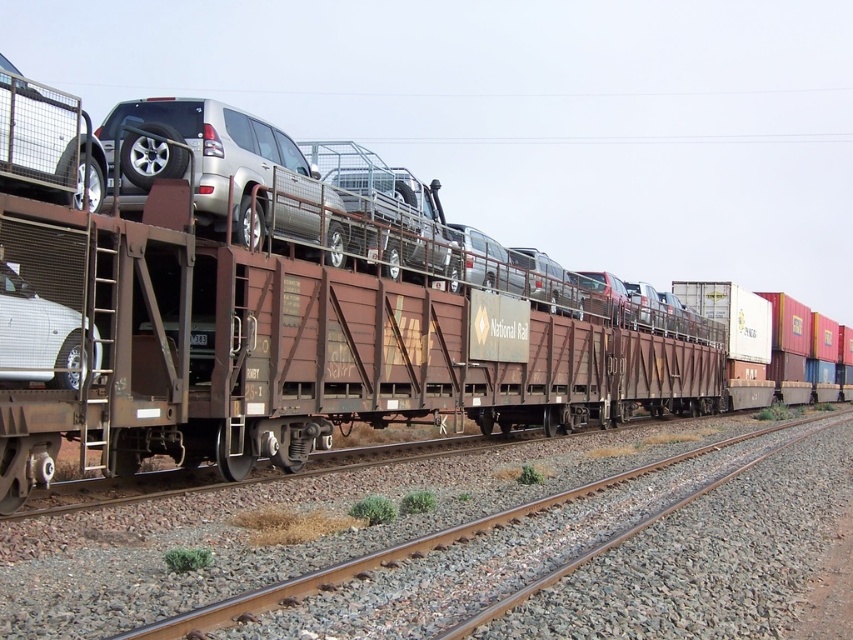
You are a delivery person trying to load a white matte sedan at left onto a brown metal train track at center. Considering their heights, will the sedan fit on the track without any modifications?

The brown metal train track at center has a greater height compared to the white matte sedan at left. Therefore, the sedan can fit on the track without needing modifications as the track is taller than the vehicle.